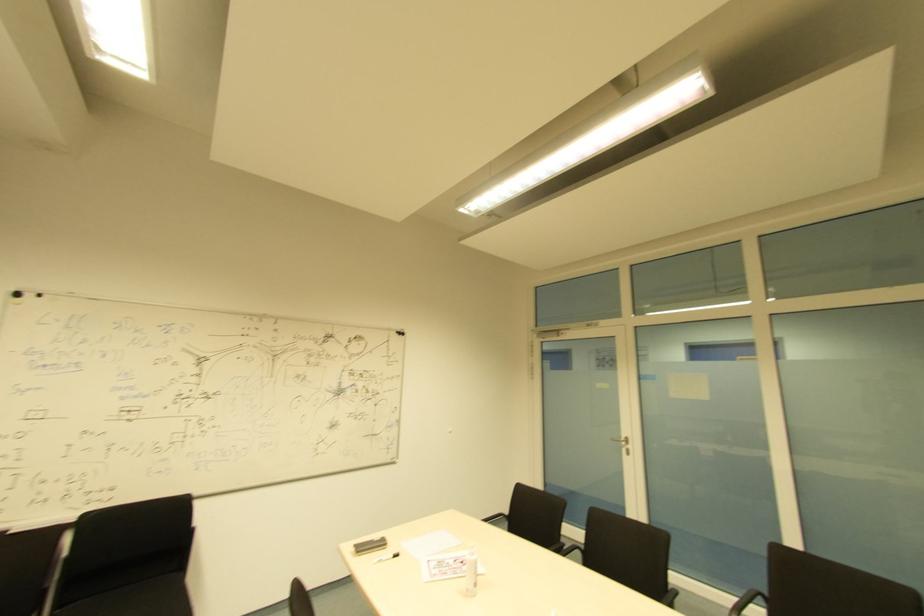
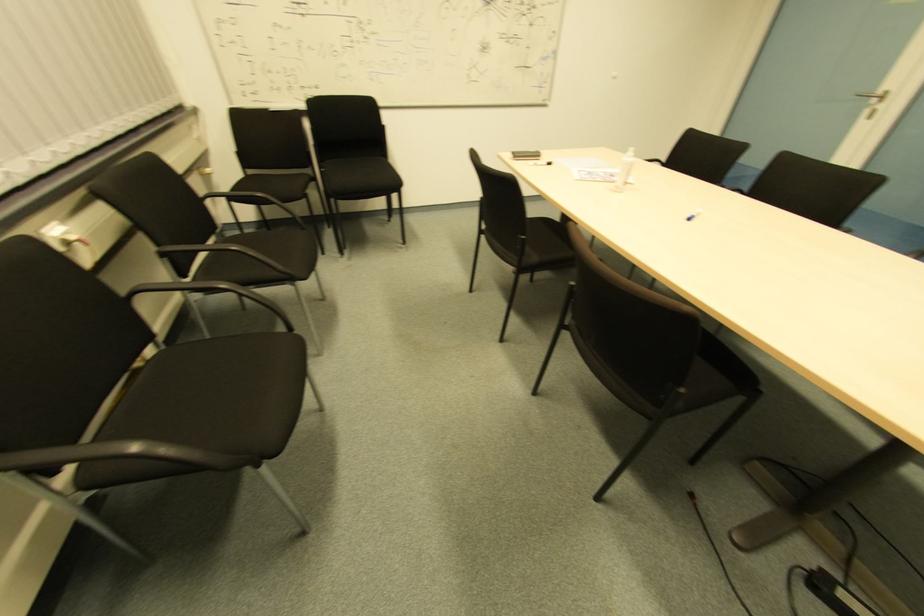
The first image is from the beginning of the video and the second image is from the end. How did the camera likely rotate when shooting the video?

The camera's rotation is toward left-down.